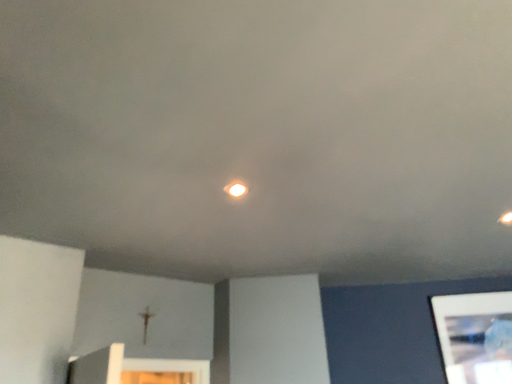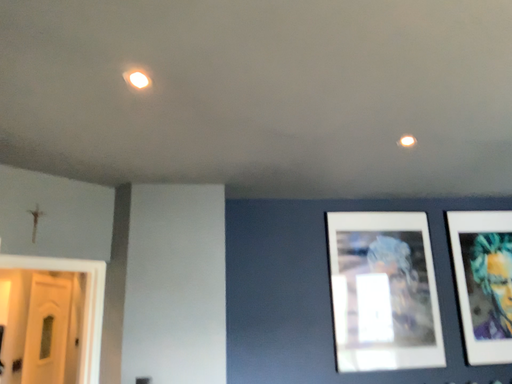
Question: How did the camera likely rotate when shooting the video?

Choices:
 (A) rotated upward
 (B) rotated downward

Answer: (B)